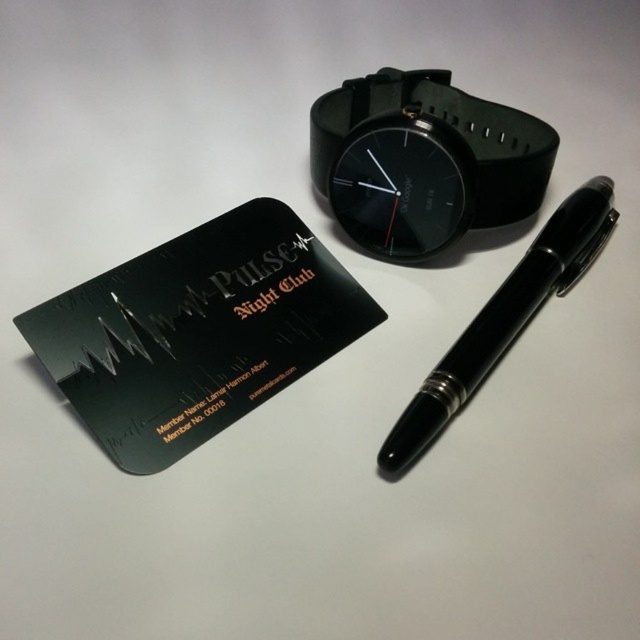
You are organizing a desk and need to place a black matte business card at lower left and a black rubber watch at upper center. Given their sizes, which item requires more space on the desk?

The black matte business card at lower left requires more space on the desk because it is larger in size than the black rubber watch at upper center.

Based on the photo, you are organizing items on a desk and need to place a new item between the black matte business card at lower left and the black rubber watch at upper center. Can you fit a 6.5 inch wide notebook between them?

The distance between the black matte business card at lower left and the black rubber watch at upper center is 12.90 inches. Since the notebook is 6.5 inches wide, it can fit within the space as 6.5 is less than half of 12.90.